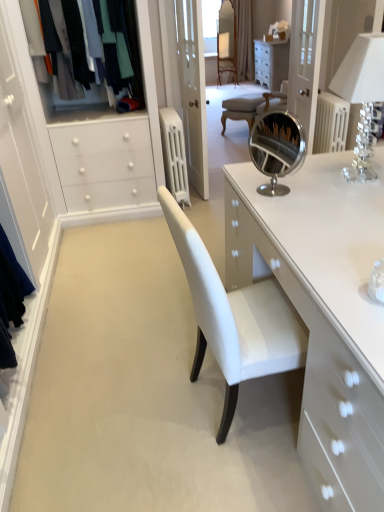
Question: Does white leather chair at center touch clear glass door at upper center?

Choices:
 (A) yes
 (B) no

Answer: (B)

Question: Considering the relative sizes of white leather chair at center and clear glass door at upper center in the image provided, is white leather chair at center taller than clear glass door at upper center?

Choices:
 (A) no
 (B) yes

Answer: (A)

Question: Is white leather chair at center to the right of clear glass door at upper center from the viewer's perspective?

Choices:
 (A) no
 (B) yes

Answer: (A)

Question: Is white leather chair at center bigger than clear glass door at upper center?

Choices:
 (A) yes
 (B) no

Answer: (A)

Question: Does white leather chair at center come behind clear glass door at upper center?

Choices:
 (A) yes
 (B) no

Answer: (A)

Question: Is beige textured curtain at upper center bigger or smaller than white leather chair at center?

Choices:
 (A) small
 (B) big

Answer: (B)

Question: Looking at their shapes, would you say beige textured curtain at upper center is wider or thinner than white leather chair at center?

Choices:
 (A) wide
 (B) thin

Answer: (B)

Question: Relative to white leather chair at center, is beige textured curtain at upper center in front or behind?

Choices:
 (A) front
 (B) behind

Answer: (B)

Question: Visually, is beige textured curtain at upper center positioned to the left or to the right of white leather chair at center?

Choices:
 (A) left
 (B) right

Answer: (B)

Question: Is white painted metal radiator at center in front of or behind white leather chair at center in the image?

Choices:
 (A) front
 (B) behind

Answer: (A)

Question: From their relative heights in the image, would you say white painted metal radiator at center is taller or shorter than white leather chair at center?

Choices:
 (A) short
 (B) tall

Answer: (B)

Question: Looking at their shapes, would you say white painted metal radiator at center is wider or thinner than white leather chair at center?

Choices:
 (A) wide
 (B) thin

Answer: (A)

Question: Is point (175, 193) closer or farther from the camera than point (248, 125)?

Choices:
 (A) closer
 (B) farther

Answer: (B)

Question: From the image's perspective, is matte black clothes at left positioned above or below beige textured curtain at upper center?

Choices:
 (A) below
 (B) above

Answer: (A)

Question: From a real-world perspective, is matte black clothes at left positioned above or below beige textured curtain at upper center?

Choices:
 (A) below
 (B) above

Answer: (B)